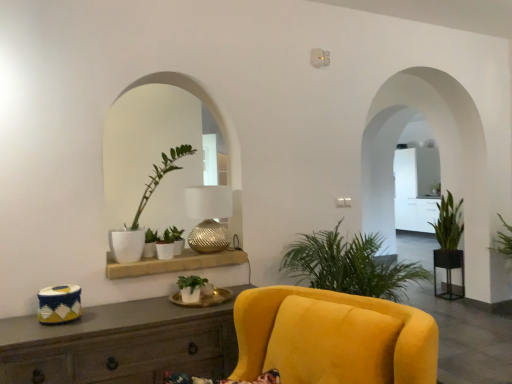
Question: Visually, is metallic textured lamp at center positioned to the left or to the right of white ceramic round table at center, acting as the first round table starting from the left?

Choices:
 (A) right
 (B) left

Answer: (A)

Question: From the image's perspective, is metallic textured lamp at center above or below white ceramic round table at center, acting as the first round table starting from the left?

Choices:
 (A) below
 (B) above

Answer: (B)

Question: Which object is positioned closest to the green matte plant at center, which is the fourth houseplant from back to front?

Choices:
 (A) green matte plant at center, arranged as the sixth houseplant when viewed from the back
 (B) green leafy plant at right, acting as the fifth houseplant starting from the front
 (C) white ceramic round table at center, which is the 1th round table from top to bottom
 (D) matte white pot at center, the 5th houseplant from the right
 (E) green matte plant at center, the sixth houseplant when ordered from right to left

Answer: (E)

Question: Which object is positioned farthest from the green matte plant at center, the sixth houseplant when ordered from right to left?

Choices:
 (A) matte white shelf at center
 (B) matte white pot at center, the 5th houseplant from the right
 (C) green matte plant at center, arranged as the sixth houseplant when viewed from the back
 (D) wooden cabinet at lower left
 (E) green leafy plant at right, acting as the fifth houseplant starting from the front

Answer: (E)